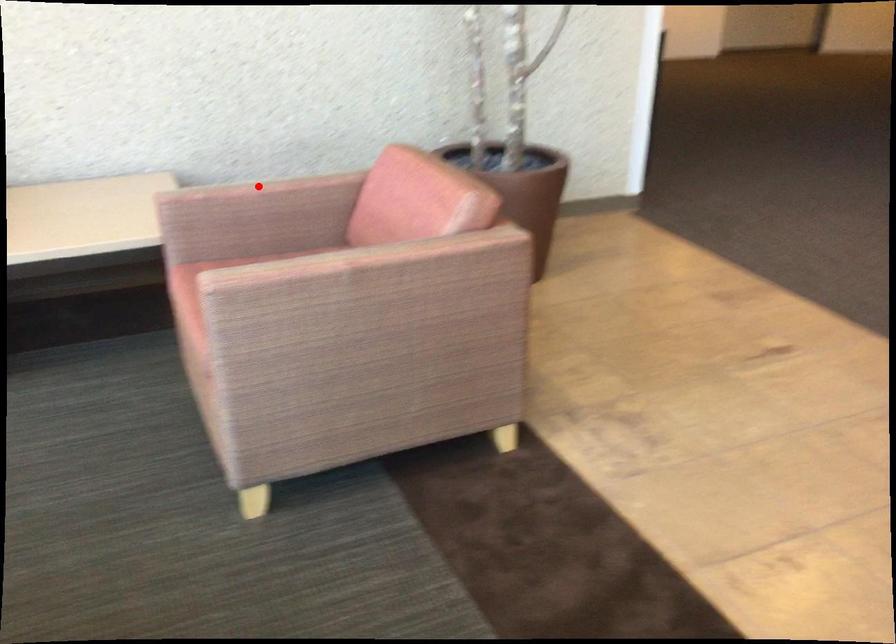
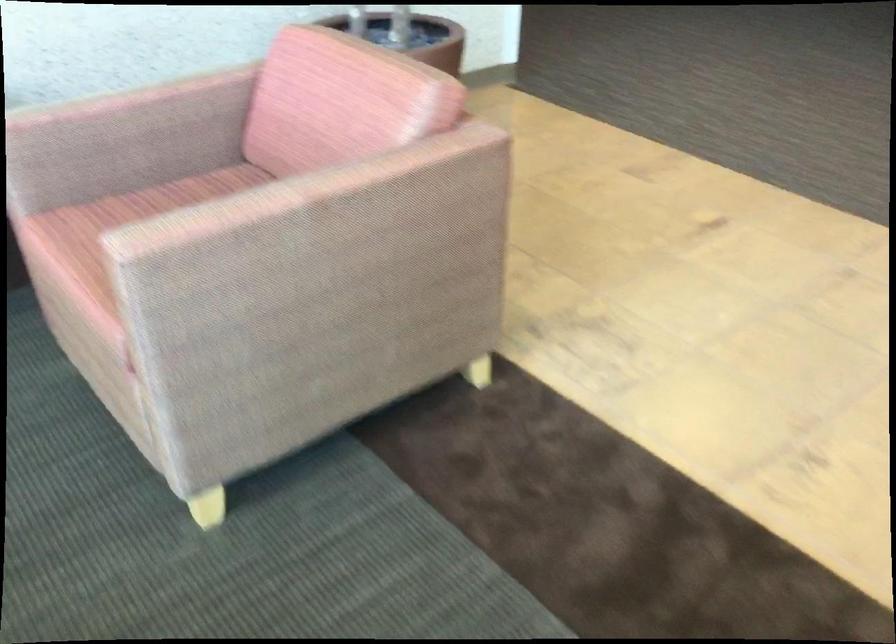
Question: I am providing you with two images of the same scene from different viewpoints. Given a red point in image1, look at the same physical point in image2. Is it:

Choices:
 (A) Closer to the viewpoint
 (B) Farther from the viewpoint

Answer: (A)